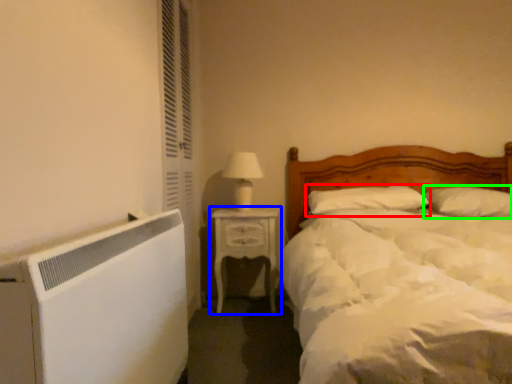
Question: Which is nearer to the pillow (highlighted by a red box)? nightstand (highlighted by a blue box) or pillow (highlighted by a green box).

Choices:
 (A) nightstand
 (B) pillow

Answer: (B)